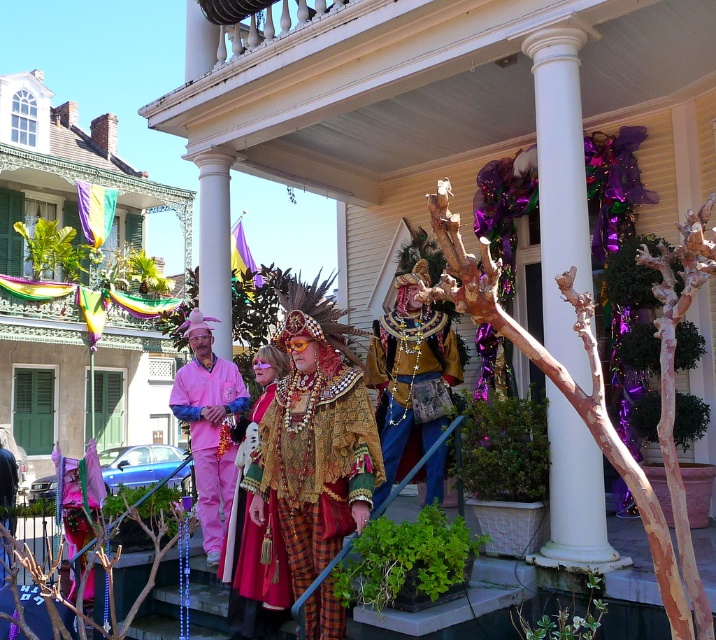
Describe the element at coordinates (314, 451) in the screenshot. This screenshot has height=640, width=716. I see `gold sequined costume at center` at that location.

Between gold sequined costume at center and pink satin shirt at center, which one appears on the left side from the viewer's perspective?

From the viewer's perspective, pink satin shirt at center appears more on the left side.

Is point (349, 509) more distant than point (208, 381)?

No, it is in front of (208, 381).

Where is `gold sequined costume at center`? gold sequined costume at center is located at coordinates point(314,451).

Measure the distance between gold sequined vest at center and pink satin shirt at center.

A distance of 5.65 feet exists between gold sequined vest at center and pink satin shirt at center.

Between gold sequined vest at center and pink satin shirt at center, which one has more height?

pink satin shirt at center is taller.

Does point (430, 305) come farther from viewer compared to point (228, 467)?

Yes, it is behind point (228, 467).

This screenshot has height=640, width=716. Find the location of `gold sequined vest at center`. gold sequined vest at center is located at coordinates (410, 371).

Does gold sequined costume at center appear on the right side of matte pink costume at center?

Indeed, gold sequined costume at center is positioned on the right side of matte pink costume at center.

Find the location of `gold sequined costume at center`. gold sequined costume at center is located at coordinates (314, 451).

Locate an element on the screen. gold sequined costume at center is located at coordinates (314, 451).